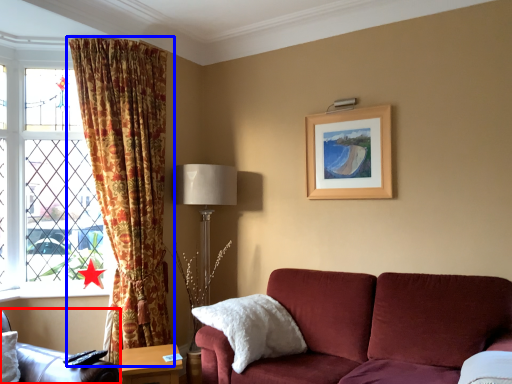
Question: Among these objects, which one is nearest to the camera, chair (highlighted by a red box) or curtain (highlighted by a blue box)?

Choices:
 (A) chair
 (B) curtain

Answer: (A)